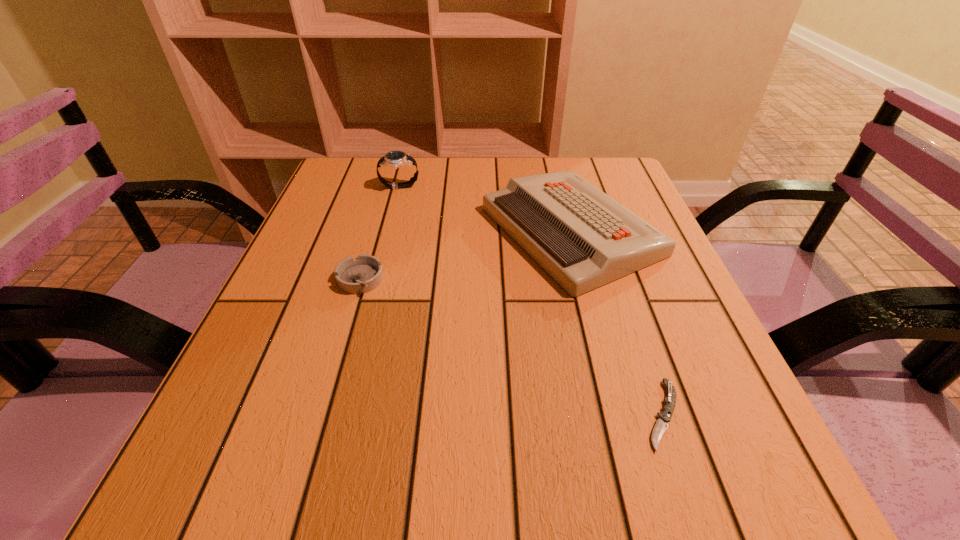
You are a GUI agent. You are given a task and a screenshot of the screen. Output one action in this format:
    pyautogui.click(x=<x>, y=<y>)
    Task: Click on the free spot between the third tallest object and the computer keyboard
    
    Given the screenshot: What is the action you would take?
    pyautogui.click(x=466, y=255)

Locate an element on the screen. unoccupied area between the tallest object and the shortest object is located at coordinates (531, 301).

At what (x,y) coordinates should I click in order to perform the action: click on vacant area that lies between the ashtray and the third shortest object. Please return your answer as a coordinate pair (x, y). Looking at the image, I should click on (466, 255).

The image size is (960, 540). What are the coordinates of `vacant space that is in between the ashtray and the third shortest object` in the screenshot? It's located at (466, 255).

This screenshot has width=960, height=540. What are the coordinates of `free space between the pocketknife and the computer keyboard` in the screenshot? It's located at (617, 323).

Locate an element on the screen. The image size is (960, 540). vacant point located between the tallest object and the ashtray is located at coordinates (380, 233).

This screenshot has width=960, height=540. Identify the location of the closest object to the computer keyboard. (394, 159).

At what (x,y) coordinates should I click in order to perform the action: click on object that is the third closest to the shortest object. Please return your answer as a coordinate pair (x, y). The height and width of the screenshot is (540, 960). Looking at the image, I should click on (394, 159).